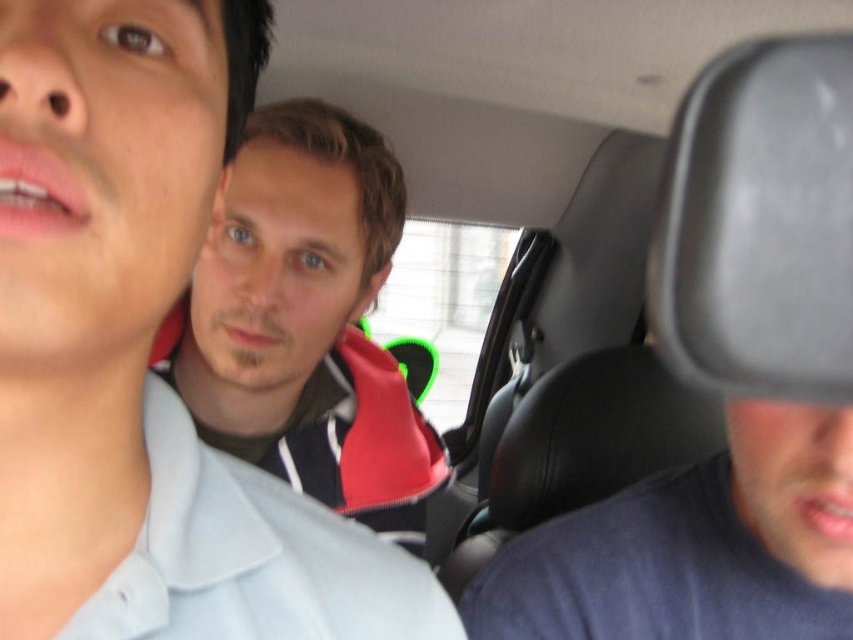
Is dark blue hoodie at center further to the viewer compared to dark blue t-shirt at lower right?

That is True.

Can you confirm if dark blue hoodie at center is positioned to the right of dark blue t-shirt at lower right?

No, dark blue hoodie at center is not to the right of dark blue t-shirt at lower right.

Is point (367, 368) farther from camera compared to point (842, 563)?

Yes.

The width and height of the screenshot is (853, 640). In order to click on dark blue hoodie at center in this screenshot , I will do `click(306, 323)`.